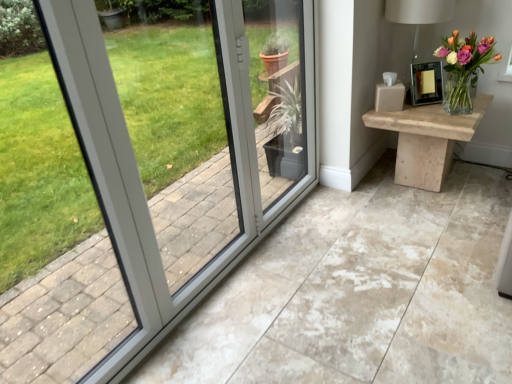
Question: From their relative heights in the image, would you say clear glass vase at upper right is taller or shorter than natural wood table at right?

Choices:
 (A) short
 (B) tall

Answer: (A)

Question: In the image, is clear glass vase at upper right on the left side or the right side of natural wood table at right?

Choices:
 (A) left
 (B) right

Answer: (B)

Question: Considering the real-world distances, which object is closest to the clear glass vase at upper right?

Choices:
 (A) matte white table lamp at upper right
 (B) natural wood table at right

Answer: (B)

Question: Considering the real-world distances, which object is closest to the clear glass vase at upper right?

Choices:
 (A) natural wood table at right
 (B) matte white table lamp at upper right

Answer: (A)